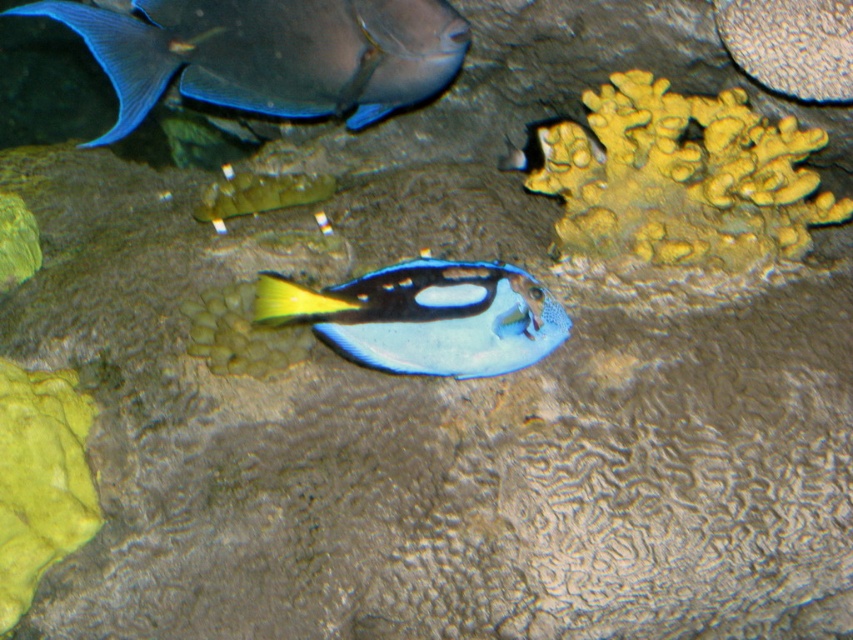
You are a robotic fish in an aquarium. You are currently at point [381,324] and want to swim to the blue tang fish. The blue tang fish is at point [746,115]. Since you can only move forward, will you be able to see the blue tang fish while moving towards it?

Point [746,115] is behind point [381,324], so the robotic fish will not be able to see the blue tang fish while moving towards it because the destination point is behind the starting point.

Consider the image. You are an underwater explorer in the aquarium. Your mission is to locate the yellow porous coral at upper right. Based on the coordinates provided, where should you look in the image?

You should look at point [682,179] in the image to find the yellow porous coral at upper right.

You are an underwater maintenance diver in an aquarium. You need to move a 1.5 meter long pipe from the blue tang fish to the yellow porous coral at upper right. Can you do it without the pipe touching either the fish or the coral?

The distance between the blue tang fish and the yellow porous coral at upper right is 1.82 meters. Since the pipe is 1.5 meters long, it can be maneuvered between them without touching either the fish or the coral.